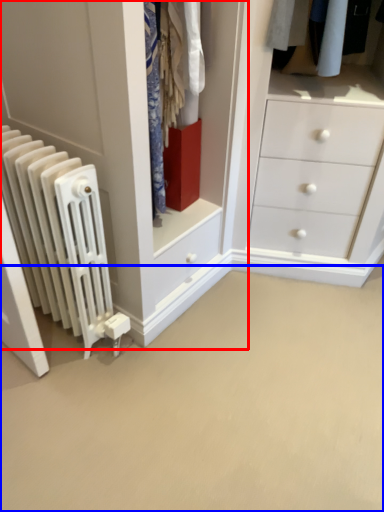
Question: Which object is closer to the camera taking this photo, closet (highlighted by a red box) or plain (highlighted by a blue box)?

Choices:
 (A) closet
 (B) plain

Answer: (B)